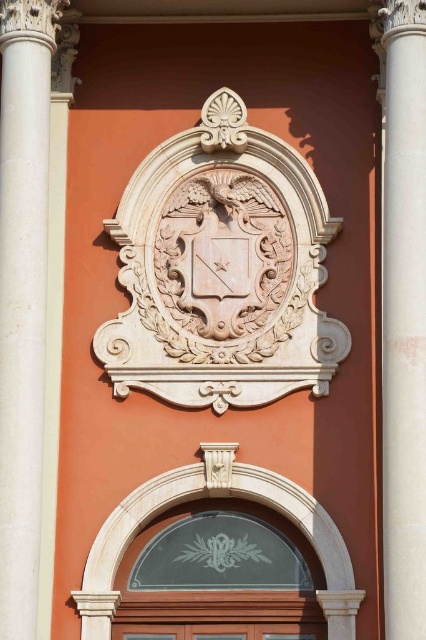
Which of these two, white marble column at right or clear glass door at center, stands shorter?

With less height is clear glass door at center.

Is point (397, 164) positioned after point (206, 493)?

No.

Identify the location of white marble column at right. This screenshot has height=640, width=426. pos(403,317).

Can you confirm if white marble column at center is positioned to the left of clear glass door at center?

Indeed, white marble column at center is positioned on the left side of clear glass door at center.

Between white marble column at center and clear glass door at center, which one has more height?

With more height is white marble column at center.

What do you see at coordinates (23, 298) in the screenshot? I see `white marble column at center` at bounding box center [23, 298].

The height and width of the screenshot is (640, 426). Identify the location of white marble column at center. click(x=23, y=298).

Does white marble column at center appear under white marble column at right?

Incorrect, white marble column at center is not positioned below white marble column at right.

From the picture: Who is positioned more to the right, white marble column at center or white marble column at right?

white marble column at right

Which is behind, point (5, 608) or point (402, 396)?

The point (402, 396) is behind.

Identify the location of white marble column at center. (23, 298).